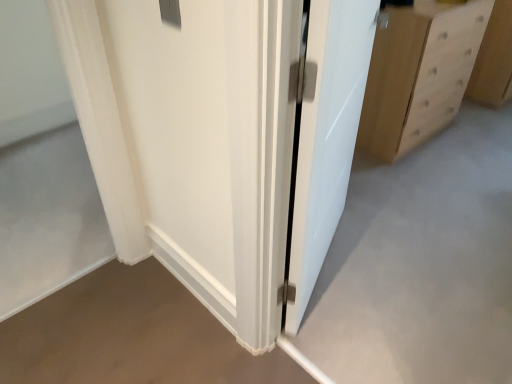
Locate an element on the screen. This screenshot has width=512, height=384. vacant area that is in front of white sheer curtain at left is located at coordinates (67, 328).